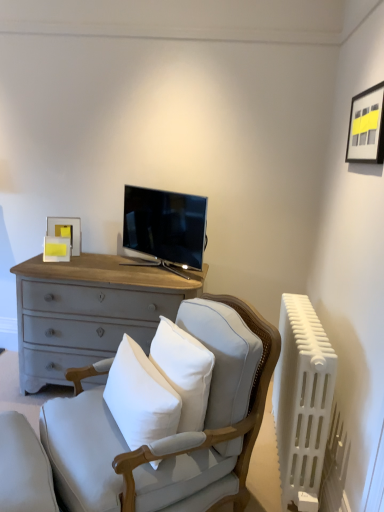
Question: Is matte black picture frame at upper right, which is counted as the 1th picture frame, starting from the top, directly adjacent to matte yellow picture frame at upper left, marked as the first picture frame in a back-to-front arrangement?

Choices:
 (A) no
 (B) yes

Answer: (A)

Question: From a real-world perspective, is matte black picture frame at upper right, the second picture frame positioned from the left, physically above matte yellow picture frame at upper left, which is the second picture frame from right to left?

Choices:
 (A) yes
 (B) no

Answer: (A)

Question: Can you confirm if matte black picture frame at upper right, which is counted as the 1th picture frame, starting from the top, is taller than matte yellow picture frame at upper left, the 2th picture frame in the front-to-back sequence?

Choices:
 (A) no
 (B) yes

Answer: (B)

Question: From a real-world perspective, is matte black picture frame at upper right, the second picture frame positioned from the left, physically below matte yellow picture frame at upper left, marked as the first picture frame in a back-to-front arrangement?

Choices:
 (A) yes
 (B) no

Answer: (B)

Question: Is matte black picture frame at upper right, placed as the first picture frame when sorted from front to back, oriented away from matte yellow picture frame at upper left, the 2th picture frame in the front-to-back sequence?

Choices:
 (A) no
 (B) yes

Answer: (A)

Question: Considering the relative positions of matte black picture frame at upper right, which is counted as the 1th picture frame, starting from the right, and matte yellow picture frame at upper left, which is the second picture frame from right to left, in the image provided, is matte black picture frame at upper right, which is counted as the 1th picture frame, starting from the right, to the right of matte yellow picture frame at upper left, which is the second picture frame from right to left, from the viewer's perspective?

Choices:
 (A) no
 (B) yes

Answer: (B)

Question: Is matte gray cushion at lower left smaller than light gray fabric rocking chair at center?

Choices:
 (A) yes
 (B) no

Answer: (A)

Question: Considering the relative positions of matte gray cushion at lower left and light gray fabric rocking chair at center in the image provided, is matte gray cushion at lower left to the left of light gray fabric rocking chair at center from the viewer's perspective?

Choices:
 (A) no
 (B) yes

Answer: (B)

Question: From the image's perspective, is matte gray cushion at lower left on top of light gray fabric rocking chair at center?

Choices:
 (A) no
 (B) yes

Answer: (A)

Question: Is matte gray cushion at lower left bigger than light gray fabric rocking chair at center?

Choices:
 (A) yes
 (B) no

Answer: (B)

Question: Does matte gray cushion at lower left have a lesser width compared to light gray fabric rocking chair at center?

Choices:
 (A) yes
 (B) no

Answer: (A)

Question: Would you say matte gray cushion at lower left contains light gray fabric rocking chair at center?

Choices:
 (A) yes
 (B) no

Answer: (B)

Question: Is matte black tv at center facing towards matte gray cushion at lower left?

Choices:
 (A) yes
 (B) no

Answer: (B)